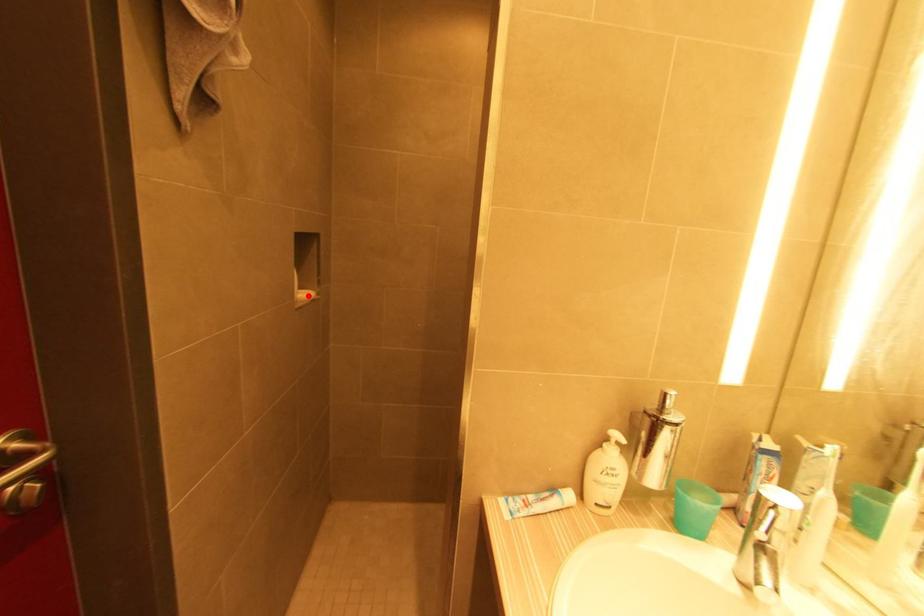
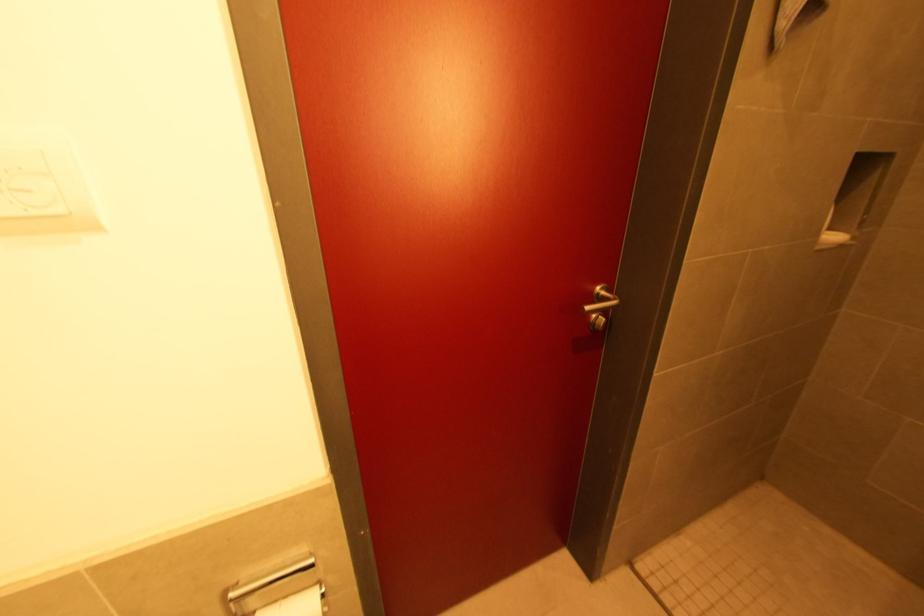
Where in the second image is the point corresponding to the highlighted location from the first image?

(833, 238)